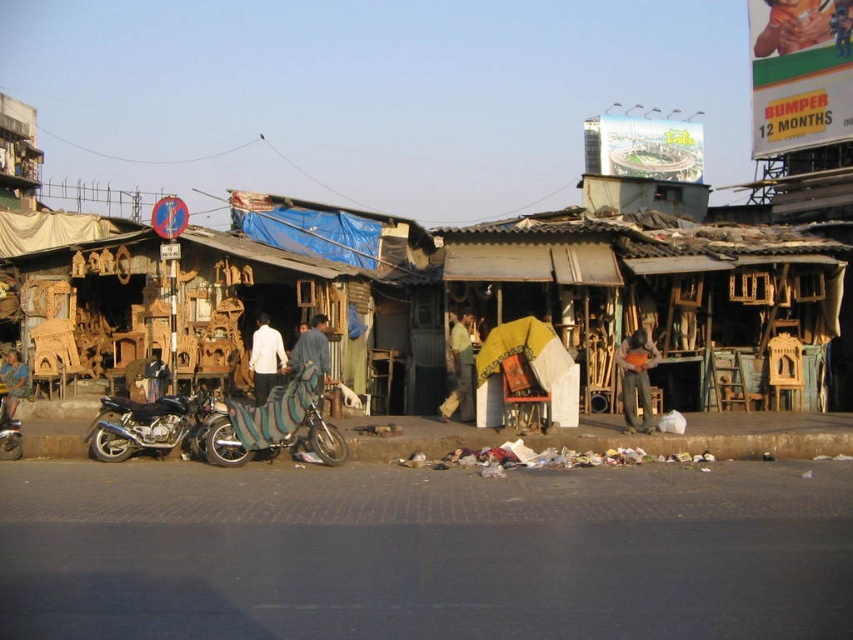
Question: From the image, what is the correct spatial relationship of wooden furniture at center in relation to shiny metallic motorcycle at center-left?

Choices:
 (A) above
 (B) below

Answer: (A)

Question: Which object is positioned farthest from the shiny metallic motorcycle at center-left?

Choices:
 (A) brown leather bag at center
 (B) green fabric bag at center
 (C) zebra-patterned fabric motorcycle at center

Answer: (A)

Question: Among these objects, which one is nearest to the camera?

Choices:
 (A) zebra-patterned leather motorcycle at lower left
 (B) green fabric bag at center
 (C) white matte shirt at center

Answer: (A)

Question: Which of these objects is positioned closest to the green fabric bag at center?

Choices:
 (A) zebra-patterned leather motorcycle at lower left
 (B) brown leather bag at center
 (C) wooden furniture at center

Answer: (B)

Question: Can you confirm if brown leather bag at center is positioned to the right of green fabric bag at center?

Choices:
 (A) no
 (B) yes

Answer: (B)

Question: Does green fabric bag at center have a larger size compared to zebra-patterned leather motorcycle at lower left?

Choices:
 (A) no
 (B) yes

Answer: (A)